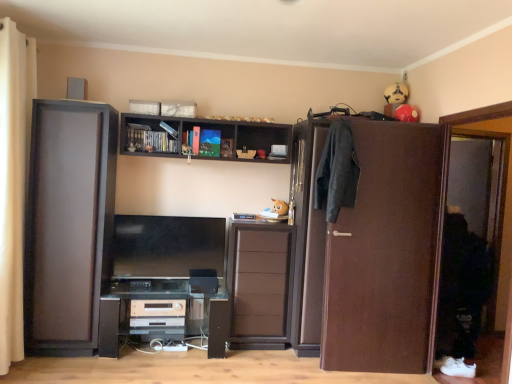
Image resolution: width=512 pixels, height=384 pixels. In order to click on free space in front of matte black cupboard at left in this screenshot , I will do `click(66, 368)`.